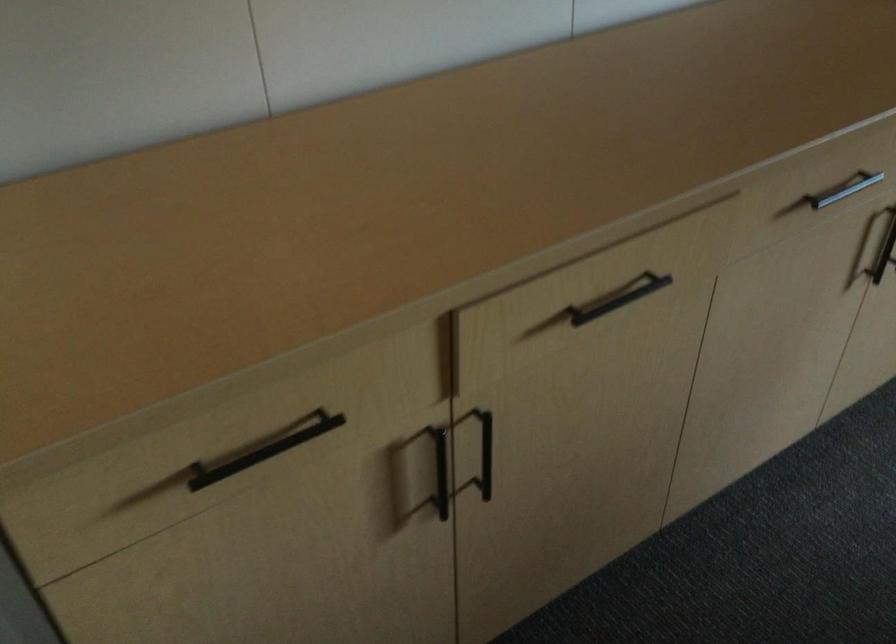
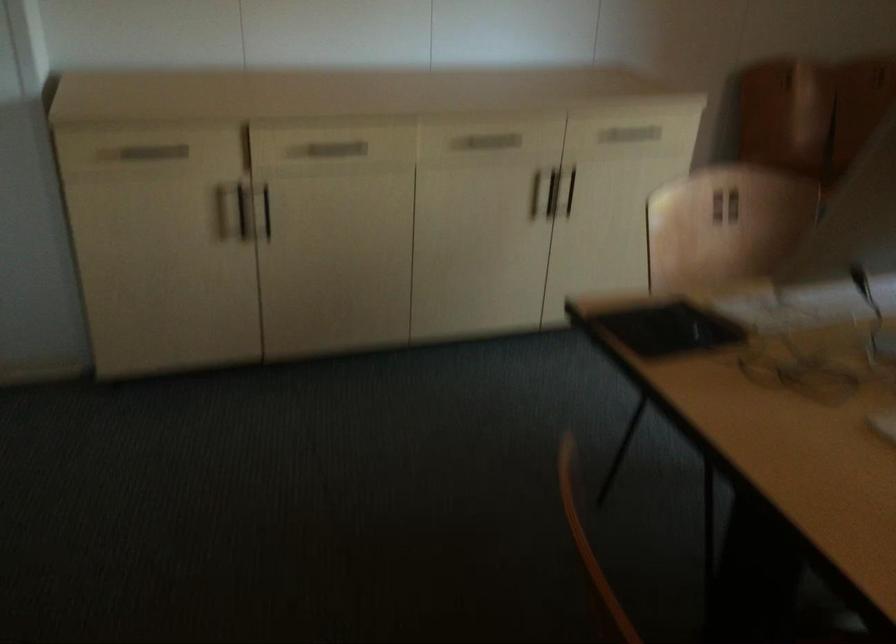
Locate, in the second image, the point that corresponds to [440,468] in the first image.

(243, 211)